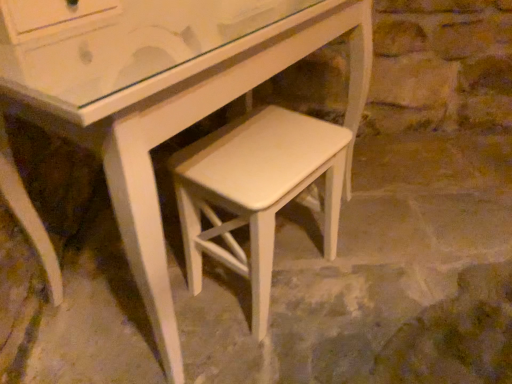
This screenshot has width=512, height=384. In order to click on vacant area to the left of white matte stool at center in this screenshot , I will do `click(144, 305)`.